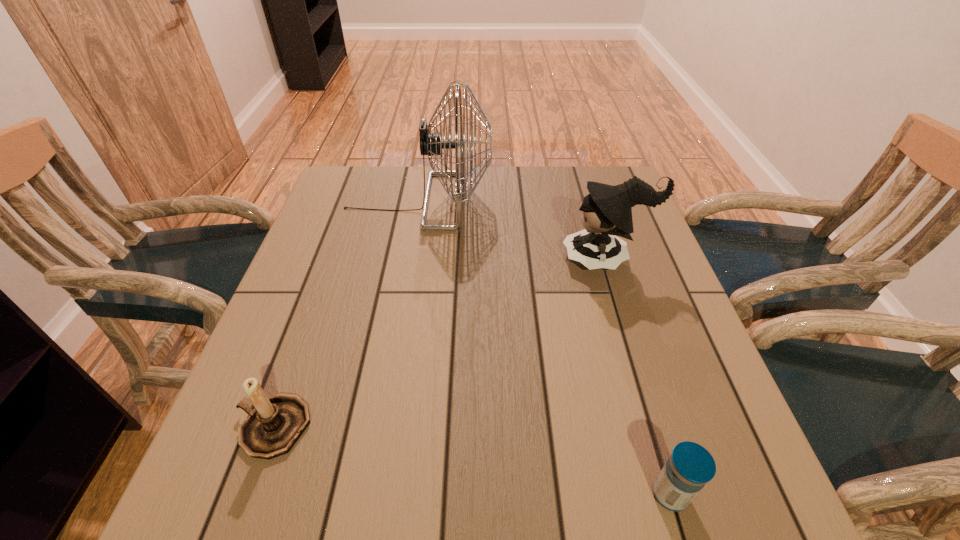
Find the location of a particular element. vacant space that satisfies the following two spatial constraints: 1. at the face of the second tallest object; 2. on the front side of the nearest object is located at coordinates (679, 494).